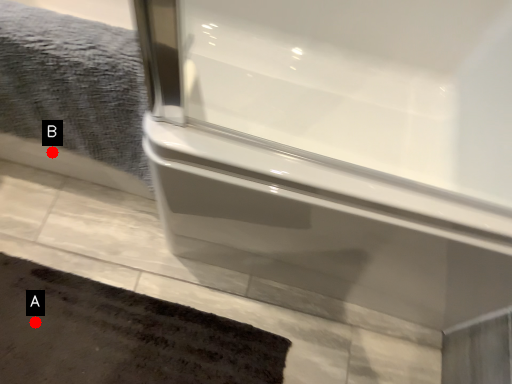
Question: Two points are circled on the image, labeled by A and B beside each circle. Which point is closer to the camera?

Choices:
 (A) A is closer
 (B) B is closer

Answer: (A)